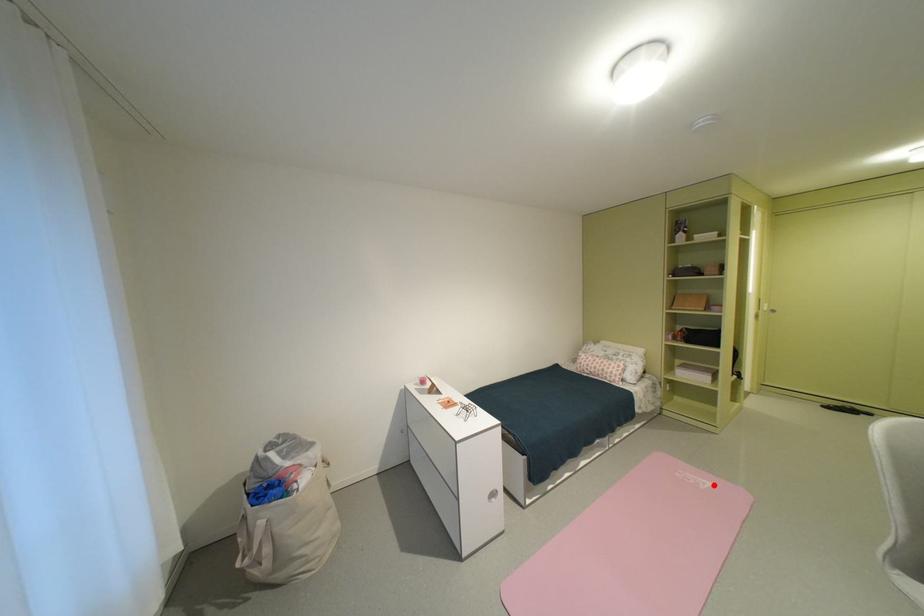
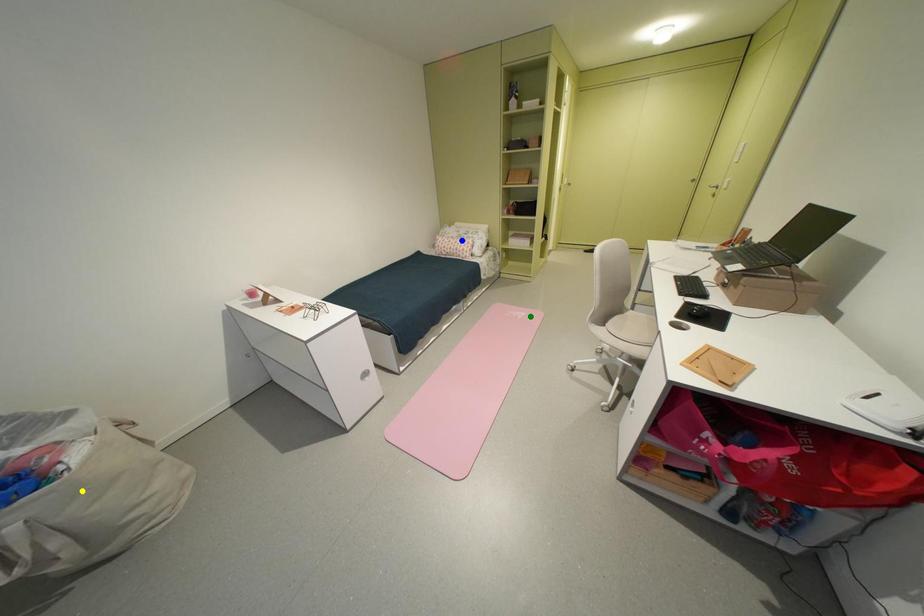
Question: I am providing you with two images of the same scene from different viewpoints. A red point is marked on the first image. You are given multiple points on the second image. Which point in image 2 is actually the same real-world point as the red point in image 1?

Choices:
 (A) yellow point
 (B) green point
 (C) blue point

Answer: (B)